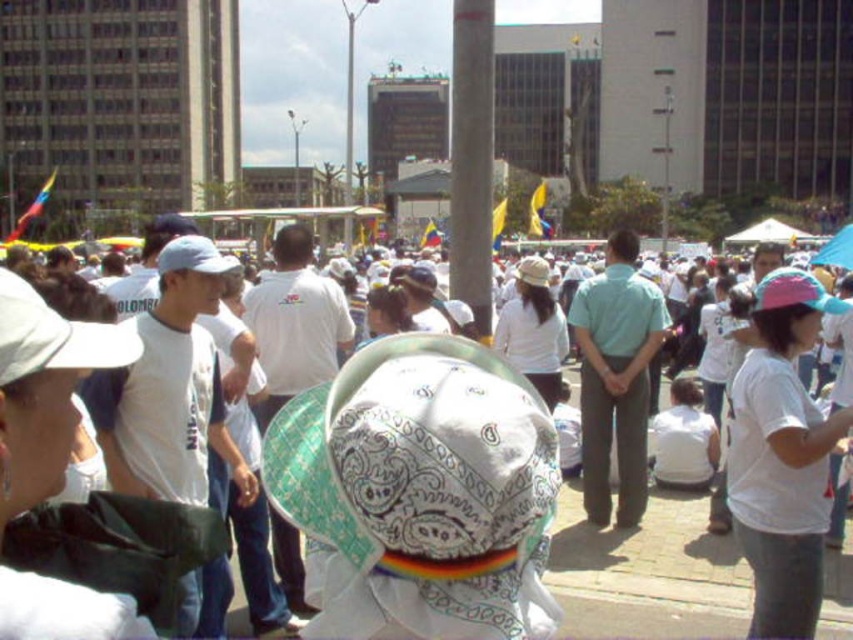
You are a photographer trying to capture a photo of the smooth concrete pole at center without any people blocking it. However, there is a person wearing a white cotton shirt at center in the way. Based on their positions, can you shift your camera slightly to the left to frame the pole without the shirt being in the shot?

The white cotton shirt at center is positioned on the right side of the smooth concrete pole at center. By shifting the camera to the left, you can frame the pole without the shirt blocking it since the shirt is to the right of the pole.

You are a photographer trying to capture a clear shot of the pink fabric cap at center and the white printed fabric baseball hat at center. Which of the two hats is blocking the view of the other?

The white printed fabric baseball hat at center is positioned over the pink fabric cap at center, so it is blocking the view of the pink fabric cap at center.

Consider the image. You are standing in the middle of the plaza and see the white printed fabric baseball hat at center and the smooth concrete pole at center. Which object is located to the left of the other?

The white printed fabric baseball hat at center is positioned on the left side of smooth concrete pole at center.